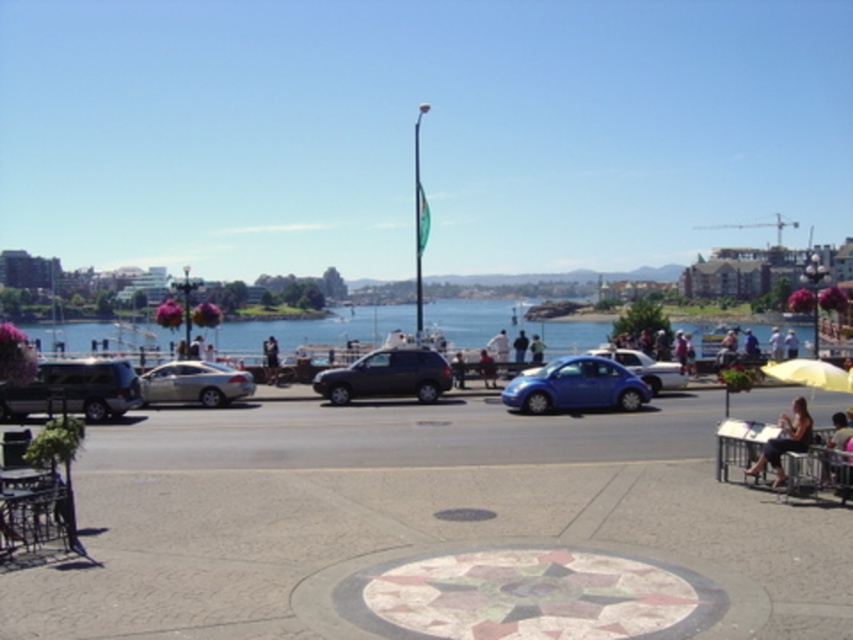
Question: Based on their relative distances, which object is nearer to the shiny blue car at center?

Choices:
 (A) light brown wooden bench at center
 (B) matte gray car at center

Answer: (B)

Question: Is satin silver sedan at center to the left of matte black jacket at center from the viewer's perspective?

Choices:
 (A) yes
 (B) no

Answer: (A)

Question: From the image, what is the correct spatial relationship of blue water at center in relation to matte black jacket at center?

Choices:
 (A) above
 (B) below

Answer: (A)

Question: Is matte black suv at left closer to the viewer compared to blue matte hatchback at center?

Choices:
 (A) no
 (B) yes

Answer: (B)

Question: Which object is the closest to the dark gray fabric jacket at center?

Choices:
 (A) matte gray car at center
 (B) satin silver sedan at center
 (C) light brown wooden bench at center
 (D) yellow matte umbrella at right

Answer: (C)

Question: Which of these objects is positioned farthest from the light brown wooden chair at lower right?

Choices:
 (A) matte gray suv at center
 (B) satin silver sedan at center
 (C) dark gray fabric jacket at center
 (D) blue fabric umbrella at center

Answer: (D)